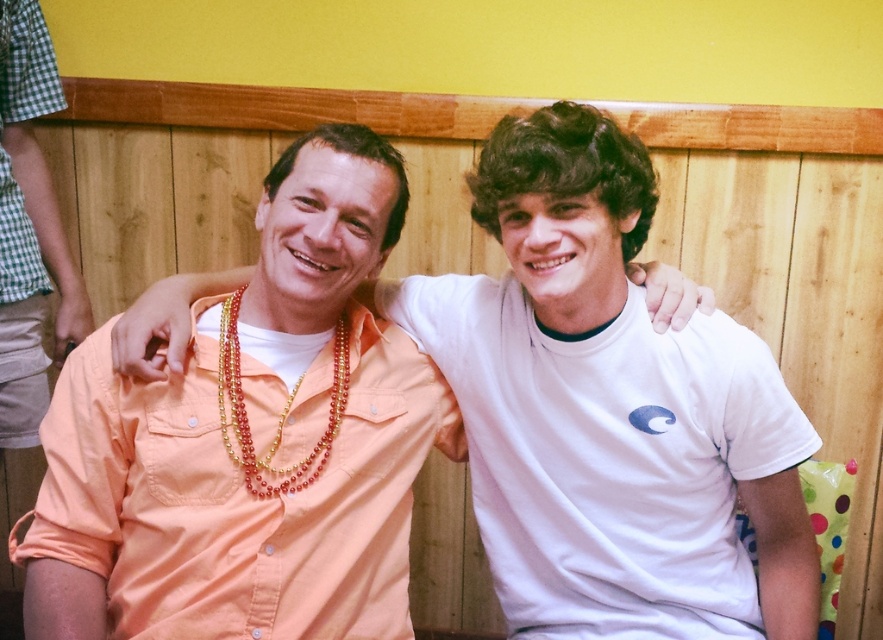
Question: Which of the following is the closest to the observer?

Choices:
 (A) white cotton t-shirt at center
 (B) checkered fabric shorts at left
 (C) orange cotton shirt at center
 (D) orange cotton shirt at left

Answer: (C)

Question: Is the position of white cotton t-shirt at center more distant than that of checkered fabric shorts at left?

Choices:
 (A) yes
 (B) no

Answer: (B)

Question: Considering the real-world distances, which object is closest to the checkered fabric shorts at left?

Choices:
 (A) orange cotton shirt at center
 (B) orange cotton shirt at left

Answer: (B)

Question: Is white cotton t-shirt at center above multicolored beaded necklace at center?

Choices:
 (A) yes
 (B) no

Answer: (B)

Question: Which of the following is the closest to the observer?

Choices:
 (A) (257, 371)
 (B) (685, 513)
 (C) (330, 397)
 (D) (743, 388)

Answer: (A)

Question: Is orange cotton shirt at left thinner than checkered fabric shorts at left?

Choices:
 (A) no
 (B) yes

Answer: (A)